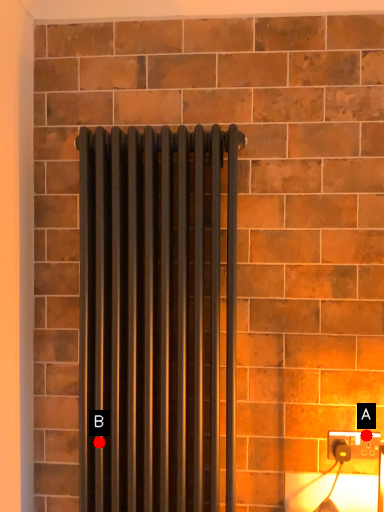
Question: Two points are circled on the image, labeled by A and B beside each circle. Among these points, which one is nearest to the camera?

Choices:
 (A) A is closer
 (B) B is closer

Answer: (B)